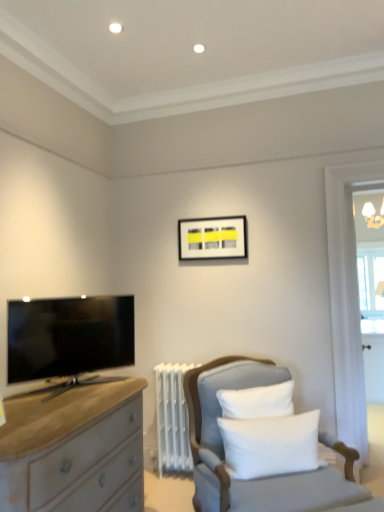
Question: Is matte black tv at left further to camera compared to white soft cushion at center?

Choices:
 (A) no
 (B) yes

Answer: (B)

Question: Is matte black tv at left beside white soft cushion at center?

Choices:
 (A) no
 (B) yes

Answer: (A)

Question: Can you confirm if matte black tv at left is smaller than white soft cushion at center?

Choices:
 (A) no
 (B) yes

Answer: (A)

Question: Does matte black tv at left have a greater width compared to white soft cushion at center?

Choices:
 (A) yes
 (B) no

Answer: (A)

Question: Does matte black tv at left appear on the left side of white soft cushion at center?

Choices:
 (A) yes
 (B) no

Answer: (A)

Question: From a real-world perspective, is clear glass window at right positioned above or below light gray fabric chair at lower right?

Choices:
 (A) below
 (B) above

Answer: (B)

Question: Would you say clear glass window at right is to the left or to the right of light gray fabric chair at lower right in the picture?

Choices:
 (A) right
 (B) left

Answer: (A)

Question: From the image's perspective, is clear glass window at right above or below light gray fabric chair at lower right?

Choices:
 (A) below
 (B) above

Answer: (B)

Question: Is point (374, 248) positioned closer to the camera than point (238, 355)?

Choices:
 (A) farther
 (B) closer

Answer: (A)

Question: Visually, is clear glass window at right positioned to the left or to the right of matte black picture frame at upper center?

Choices:
 (A) left
 (B) right

Answer: (B)

Question: In terms of size, does clear glass window at right appear bigger or smaller than matte black picture frame at upper center?

Choices:
 (A) big
 (B) small

Answer: (A)

Question: From the image's perspective, relative to matte black picture frame at upper center, is clear glass window at right above or below?

Choices:
 (A) below
 (B) above

Answer: (A)

Question: Is clear glass window at right spatially inside matte black picture frame at upper center, or outside of it?

Choices:
 (A) outside
 (B) inside

Answer: (A)

Question: Is point (26, 323) closer or farther from the camera than point (365, 307)?

Choices:
 (A) farther
 (B) closer

Answer: (B)

Question: Based on their sizes in the image, would you say matte black tv at left is bigger or smaller than clear glass window at right?

Choices:
 (A) big
 (B) small

Answer: (B)